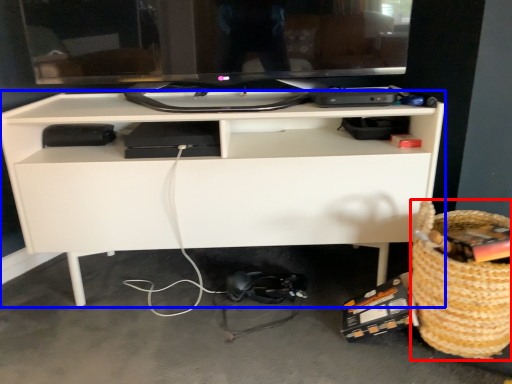
Question: Which object appears farthest to the camera in this image, basket (highlighted by a red box) or desk (highlighted by a blue box)?

Choices:
 (A) basket
 (B) desk

Answer: (B)